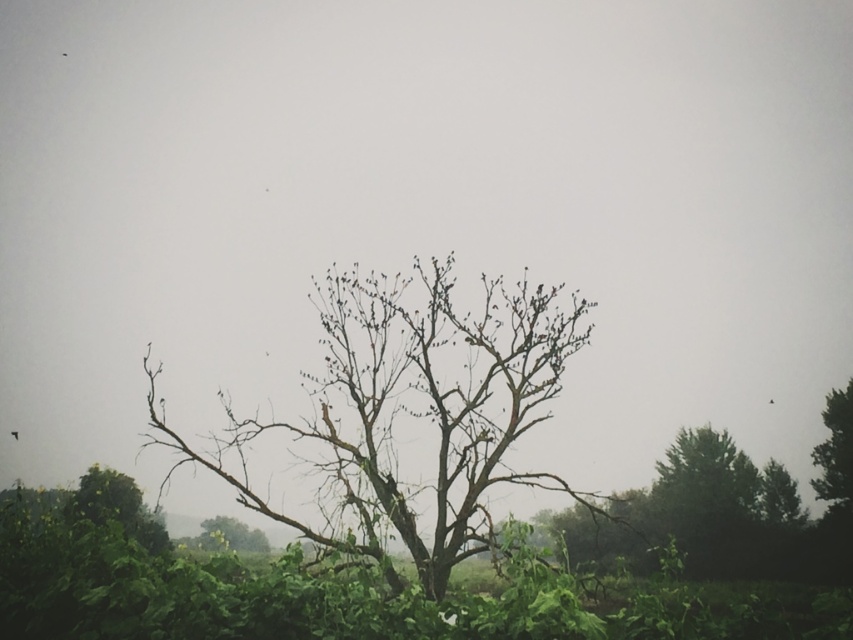
Is green matte tree at lower center positioned behind brown feathered bird at center?

No, it is not.

Between green matte tree at lower center and brown feathered bird at center, which one appears on the left side from the viewer's perspective?

From the viewer's perspective, green matte tree at lower center appears more on the left side.

Locate an element on the screen. green matte tree at lower center is located at coordinates (228, 536).

Who is higher up, green leafy bush at lower left or green textured tree at right?

green leafy bush at lower left is above.

Based on the photo, does green leafy bush at lower left appear on the right side of green textured tree at right?

In fact, green leafy bush at lower left is to the left of green textured tree at right.

Which is in front, point (144, 534) or point (836, 433)?

Positioned in front is point (144, 534).

What are the coordinates of `green leafy bush at lower left` in the screenshot? It's located at (117, 508).

Which is above, green leafy bush at lower left or black matte bird at center?

Positioned higher is black matte bird at center.

Does green leafy bush at lower left have a lesser height compared to black matte bird at center?

No, green leafy bush at lower left is not shorter than black matte bird at center.

Describe the element at coordinates (117, 508) in the screenshot. I see `green leafy bush at lower left` at that location.

This screenshot has height=640, width=853. What are the coordinates of `green leafy bush at lower left` in the screenshot? It's located at (117, 508).